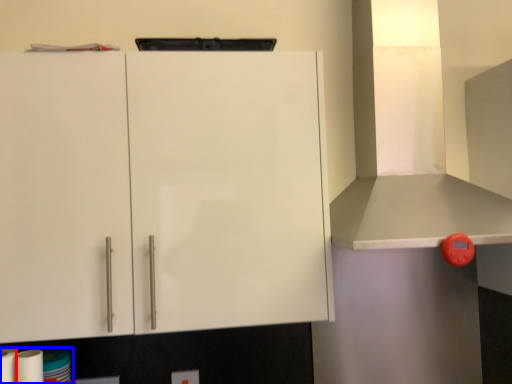
Question: Which point is further to the camera, paper towel (highlighted by a red box) or toilet paper (highlighted by a blue box)?

Choices:
 (A) paper towel
 (B) toilet paper

Answer: (B)